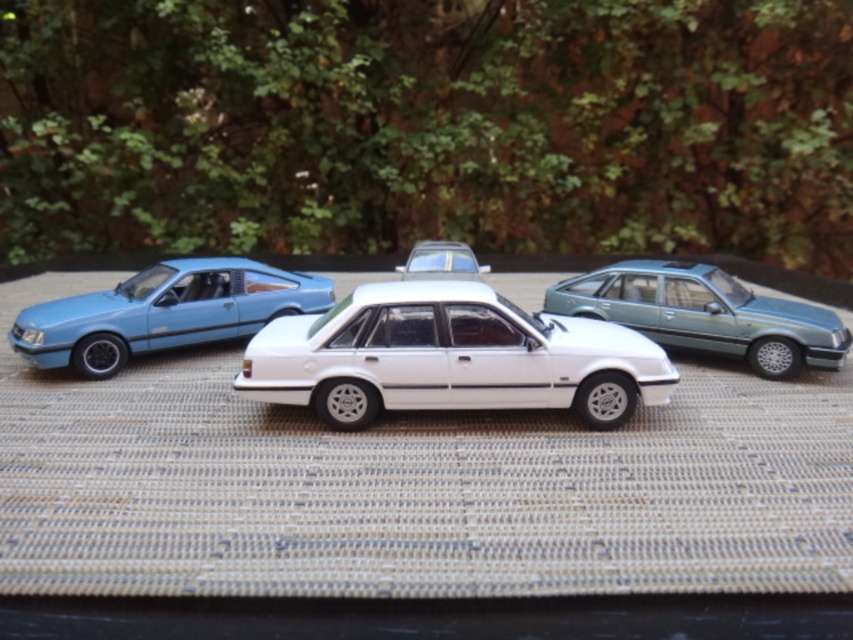
You are a collector of vintage model cars and you have a display shelf that requires the car to be no taller than 10 cm. You have two cars in front of you, the white glossy sedan at center and the metallic teal sedan at right. Which car should you choose to place on the shelf?

The metallic teal sedan at right is shorter than the white glossy sedan at center. Since the white glossy sedan at center is much taller, the metallic teal sedan at right would be the better choice to fit on the display shelf that requires cars to be no taller than 10 cm.

You are standing 2 meters away from the metallic teal sedan at right. Can you reach it without moving your feet?

The metallic teal sedan at right is 1.74 meters away from the viewer. Since you are standing 2 meters away from it, you cannot reach it without moving your feet.